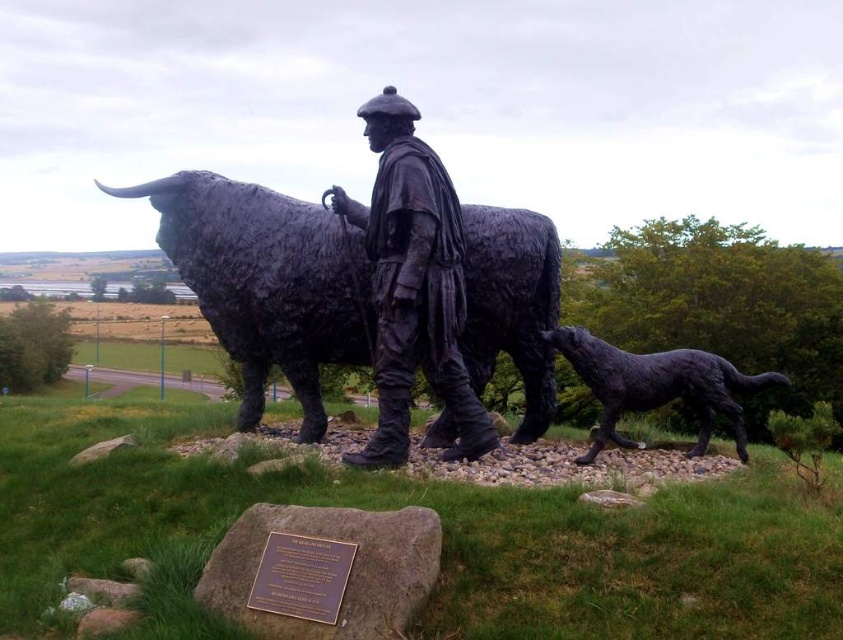
Question: Which point is farther from the camera taking this photo?

Choices:
 (A) (482, 433)
 (B) (341, 340)

Answer: (B)

Question: Which object appears closest to the camera in this image?

Choices:
 (A) black polished stone bull at center
 (B) bronze statue of man at center

Answer: (B)

Question: Is black polished stone bull at center behind shiny black dog at lower right?

Choices:
 (A) yes
 (B) no

Answer: (A)

Question: Which object is farther from the camera taking this photo?

Choices:
 (A) shiny black dog at lower right
 (B) bronze statue of man at center

Answer: (A)

Question: Where is black polished stone bull at center located in relation to bronze statue of man at center in the image?

Choices:
 (A) right
 (B) left

Answer: (B)

Question: Is black polished stone bull at center to the left of shiny black dog at lower right from the viewer's perspective?

Choices:
 (A) yes
 (B) no

Answer: (A)